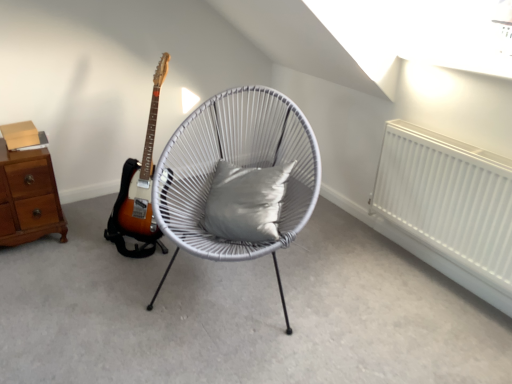
The width and height of the screenshot is (512, 384). What are the coordinates of `free space in front of brown wood chest of drawers at left` in the screenshot? It's located at (33, 264).